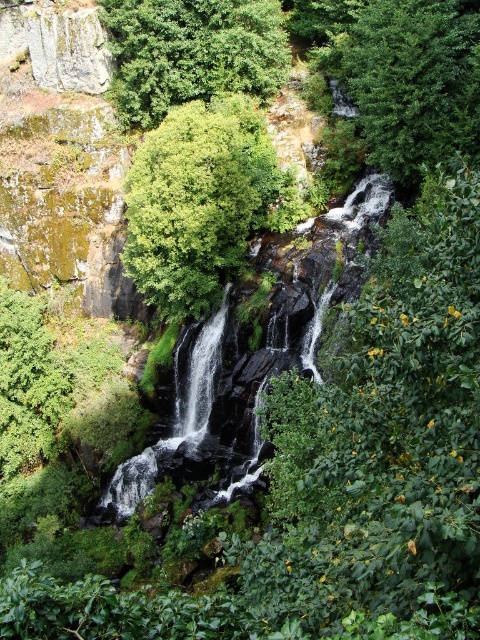
You are standing at the edge of the cliff overlooking the green leafy tree at center and the green mossy waterfall at center. Which object is higher in elevation?

The green leafy tree at center is positioned over the green mossy waterfall at center, so it is higher in elevation.